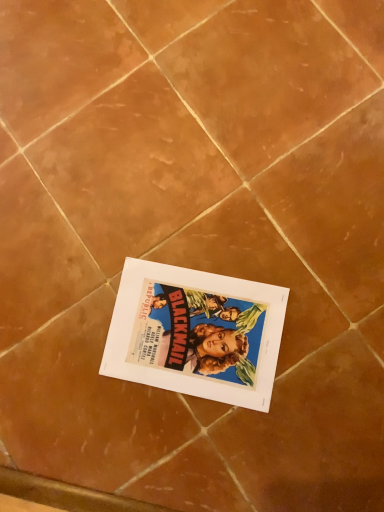
I want to click on empty space that is to the right of matte paper poster at center, so click(x=284, y=248).